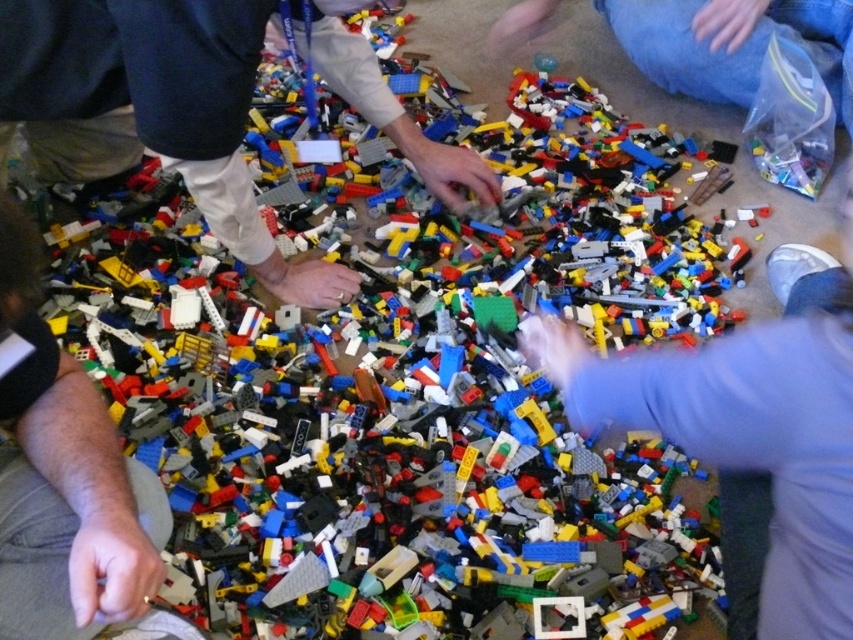
Can you confirm if matte white pants at center is smaller than dark gray fabric hand at lower left?

No, matte white pants at center is not smaller than dark gray fabric hand at lower left.

Can you confirm if matte white pants at center is shorter than dark gray fabric hand at lower left?

No, matte white pants at center is not shorter than dark gray fabric hand at lower left.

Between point (450, 168) and point (102, 538), which one is positioned in front?

Point (102, 538) is in front.

In order to click on matte white pants at center in this screenshot , I will do `click(155, 108)`.

Between point (805, 628) and point (676, 83), which one is positioned behind?

The point (676, 83) is behind.

Consider the image. Is smooth plastic hand at center wider than blue jeans at upper right?

In fact, smooth plastic hand at center might be narrower than blue jeans at upper right.

Measure the distance between smooth plastic hand at center and camera.

smooth plastic hand at center and camera are 74.03 centimeters apart.

Identify the location of smooth plastic hand at center. The height and width of the screenshot is (640, 853). (749, 429).

Does smooth plastic hand at center appear on the right side of dark gray fabric hand at lower left?

Yes, smooth plastic hand at center is to the right of dark gray fabric hand at lower left.

Looking at this image, does smooth plastic hand at center have a greater width compared to dark gray fabric hand at lower left?

Yes, smooth plastic hand at center is wider than dark gray fabric hand at lower left.

What do you see at coordinates (749, 429) in the screenshot? This screenshot has width=853, height=640. I see `smooth plastic hand at center` at bounding box center [749, 429].

Where is `smooth plastic hand at center`? smooth plastic hand at center is located at coordinates (749, 429).